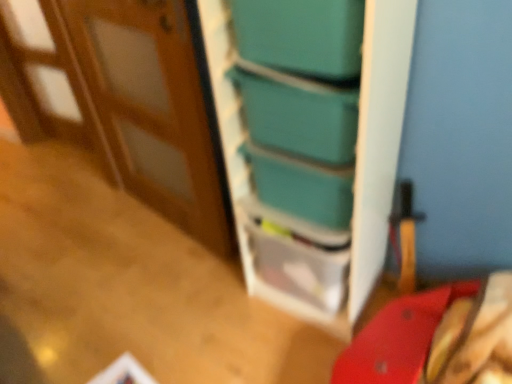
Question: Is teal plastic bookshelf at center at the right side of teal plastic box at upper center, the second box from the bottom?

Choices:
 (A) yes
 (B) no

Answer: (A)

Question: Can you confirm if teal plastic bookshelf at center is positioned to the left of teal plastic box at upper center, the second box from the bottom?

Choices:
 (A) yes
 (B) no

Answer: (B)

Question: Does teal plastic bookshelf at center have a greater width compared to teal plastic box at upper center, which is the 1th box in top-to-bottom order?

Choices:
 (A) no
 (B) yes

Answer: (B)

Question: Is teal plastic bookshelf at center outside of teal plastic box at upper center, which is the 1th box in top-to-bottom order?

Choices:
 (A) yes
 (B) no

Answer: (A)

Question: From the image's perspective, is teal plastic bookshelf at center under teal plastic box at upper center, which is the 1th box in top-to-bottom order?

Choices:
 (A) no
 (B) yes

Answer: (B)

Question: From the image's perspective, is smooth red table at lower right located above or below teal plastic box at center, which is the 2th box in top-to-bottom order?

Choices:
 (A) below
 (B) above

Answer: (A)

Question: Is smooth red table at lower right bigger or smaller than teal plastic box at center, which is the 2th box in top-to-bottom order?

Choices:
 (A) small
 (B) big

Answer: (B)

Question: From a real-world perspective, relative to teal plastic box at center, which is the 2th box in top-to-bottom order, is smooth red table at lower right vertically above or below?

Choices:
 (A) below
 (B) above

Answer: (A)

Question: In terms of height, does smooth red table at lower right look taller or shorter compared to teal plastic box at center, placed as the first box when sorted from bottom to top?

Choices:
 (A) tall
 (B) short

Answer: (B)

Question: Is teal plastic drawer at center in front of or behind teal plastic bookshelf at center in the image?

Choices:
 (A) front
 (B) behind

Answer: (B)

Question: Visually, is teal plastic drawer at center positioned to the left or to the right of teal plastic bookshelf at center?

Choices:
 (A) left
 (B) right

Answer: (B)

Question: Is teal plastic drawer at center taller or shorter than teal plastic bookshelf at center?

Choices:
 (A) short
 (B) tall

Answer: (A)

Question: Choose the correct answer: Is teal plastic drawer at center inside teal plastic bookshelf at center or outside it?

Choices:
 (A) outside
 (B) inside

Answer: (B)

Question: In terms of width, does teal plastic bookshelf at center look wider or thinner when compared to teal plastic drawer at center?

Choices:
 (A) thin
 (B) wide

Answer: (B)

Question: Looking at the image, does teal plastic bookshelf at center seem bigger or smaller compared to teal plastic drawer at center?

Choices:
 (A) big
 (B) small

Answer: (A)